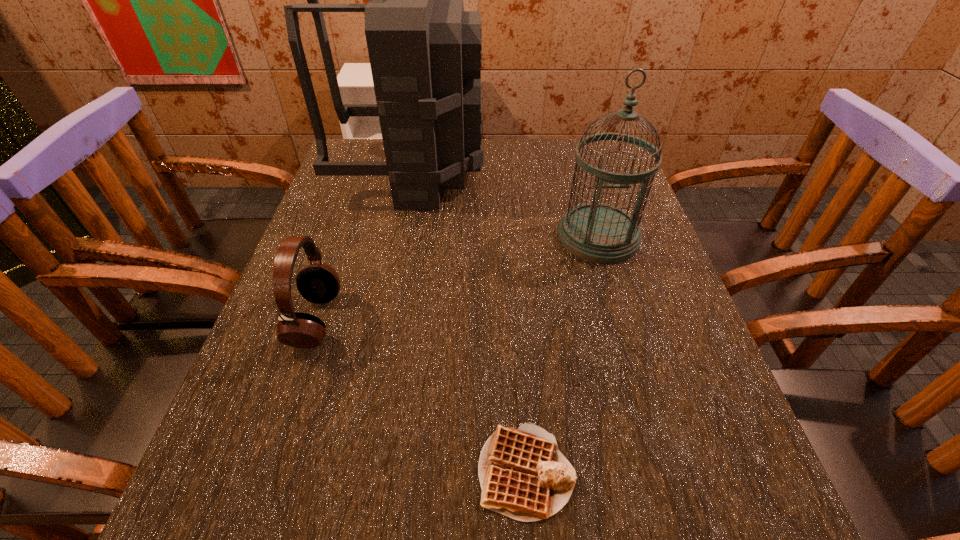
Image resolution: width=960 pixels, height=540 pixels. What are the coordinates of `empty location between the nearest object and the backpack` in the screenshot? It's located at (469, 322).

This screenshot has width=960, height=540. In order to click on vacant space in between the rightmost object and the tallest object in this screenshot , I will do `click(505, 205)`.

In order to click on free space that is in between the tallest object and the shortest object in this screenshot , I will do `click(469, 322)`.

Find the location of a particular element. The image size is (960, 540). free space between the backpack and the nearest object is located at coordinates (469, 322).

This screenshot has width=960, height=540. In order to click on object identified as the closest to the headset in this screenshot , I will do `click(425, 51)`.

Select which object is the second closest to the third tallest object. Please provide its 2D coordinates. Your answer should be formatted as a tuple, i.e. [(x, y)], where the tuple contains the x and y coordinates of a point satisfying the conditions above.

[(523, 475)]

Locate an element on the screen. The width and height of the screenshot is (960, 540). vacant region that satisfies the following two spatial constraints: 1. on the front-facing side of the birdcage; 2. on the ear pads of the headset is located at coordinates (623, 320).

In order to click on free space in the image that satisfies the following two spatial constraints: 1. on the ear pads of the second shortest object; 2. on the back side of the waffle in this screenshot , I will do `click(265, 470)`.

This screenshot has width=960, height=540. In order to click on blank space that satisfies the following two spatial constraints: 1. on the back side of the nearest object; 2. on the front compartment of the tallest object in this screenshot , I will do `click(505, 173)`.

This screenshot has height=540, width=960. Find the location of `vacant space that satisfies the following two spatial constraints: 1. on the front compartment of the backpack; 2. on the left side of the waffle`. vacant space that satisfies the following two spatial constraints: 1. on the front compartment of the backpack; 2. on the left side of the waffle is located at coordinates (351, 470).